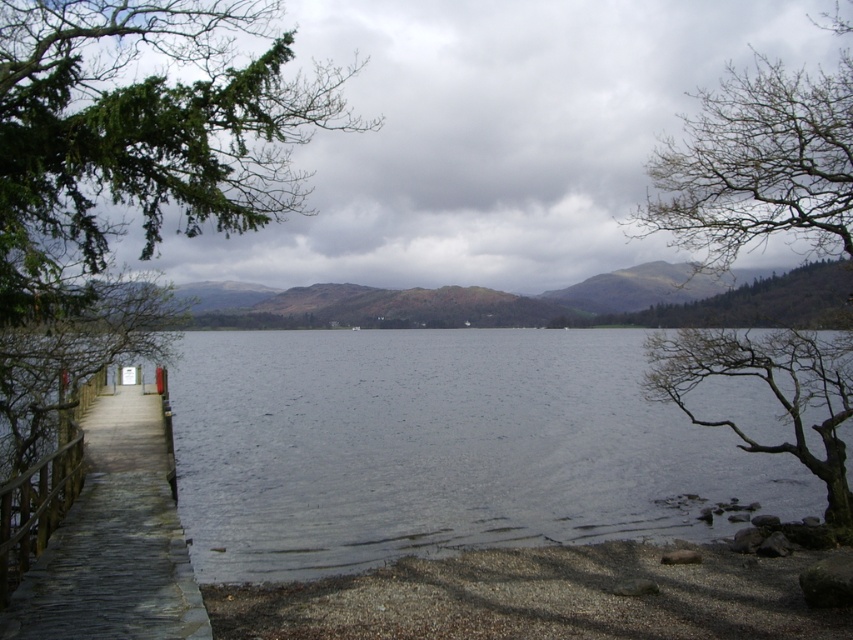
Question: Is smooth gravel shore at lower right closer to the viewer compared to green mossy hillside at center?

Choices:
 (A) no
 (B) yes

Answer: (B)

Question: Is smooth gravel shore at lower right below wooden dock at left?

Choices:
 (A) yes
 (B) no

Answer: (A)

Question: Which point is farther from the camera taking this photo?

Choices:
 (A) (303, 554)
 (B) (36, 477)
 (C) (824, 189)

Answer: (A)

Question: Which point is closer to the camera?

Choices:
 (A) (828, 150)
 (B) (173, 58)
 (C) (354, 308)

Answer: (B)

Question: Which of these objects is positioned closest to the gray water at center?

Choices:
 (A) bare branches at right
 (B) green leafy tree at upper left
 (C) smooth gravel shore at lower right

Answer: (A)

Question: Does green leafy tree at upper left have a greater width compared to wooden dock at left?

Choices:
 (A) yes
 (B) no

Answer: (B)